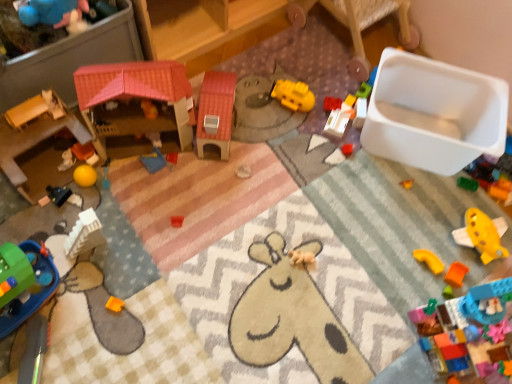
This screenshot has height=384, width=512. What are the coordinates of `free point behind green plastic toy at lower left, the fourteenth toy viewed from the right` in the screenshot? It's located at (46, 225).